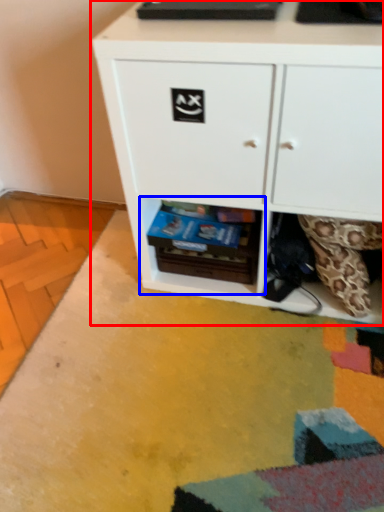
Question: Which object is closer to the camera taking this photo, chest of drawers (highlighted by a red box) or shelf (highlighted by a blue box)?

Choices:
 (A) chest of drawers
 (B) shelf

Answer: (A)